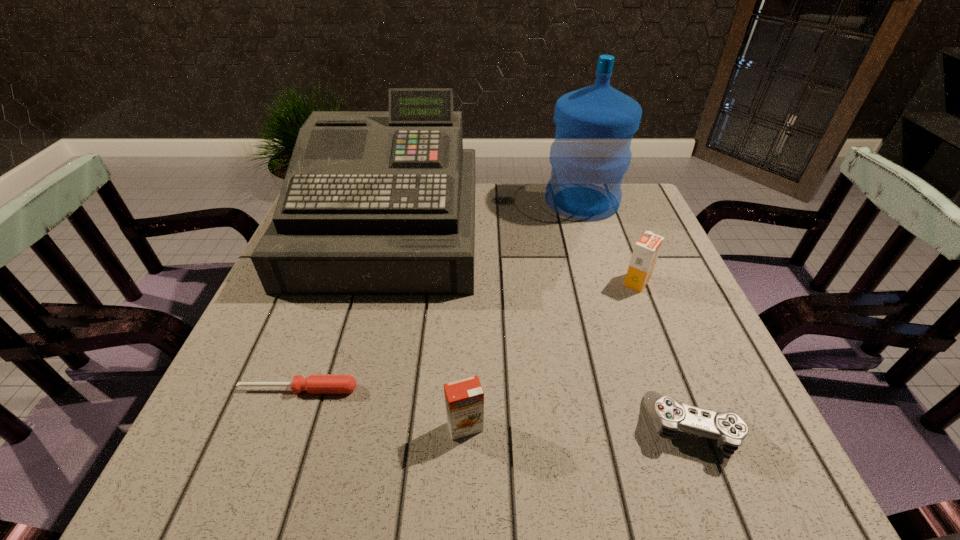
Identify the location of vacant space located 0.220m on the left of the fifth tallest object. (515, 427).

At what (x,y) coordinates should I click in order to perform the action: click on vacant space located 0.400m on the back of the shortest object. Please return your answer as a coordinate pair (x, y). This screenshot has width=960, height=540. Looking at the image, I should click on (349, 246).

You are a GUI agent. You are given a task and a screenshot of the screen. Output one action in this format:
    pyautogui.click(x=<x>, y=<y>)
    Task: Click on the water jug at the far edge
    
    Given the screenshot: What is the action you would take?
    pyautogui.click(x=591, y=152)

Find the location of a particular element. The height and width of the screenshot is (540, 960). cash register situated at the far edge is located at coordinates (373, 202).

Locate an element on the screen. Image resolution: width=960 pixels, height=540 pixels. orange juice that is at the near edge is located at coordinates (464, 399).

Image resolution: width=960 pixels, height=540 pixels. Find the location of `control that is positioned at the near edge`. control that is positioned at the near edge is located at coordinates (668, 415).

You are a GUI agent. You are given a task and a screenshot of the screen. Output one action in this format:
    pyautogui.click(x=<x>, y=<y>)
    Task: Click on the cash register that is at the left edge
    The width and height of the screenshot is (960, 540).
    Given the screenshot: What is the action you would take?
    pyautogui.click(x=373, y=202)

You are a GUI agent. You are given a task and a screenshot of the screen. Output one action in this format:
    pyautogui.click(x=<x>, y=<y>)
    Task: Click on the screwdriver that is positioned at the left edge
    Image resolution: width=960 pixels, height=540 pixels.
    Given the screenshot: What is the action you would take?
    pyautogui.click(x=315, y=384)

Identify the location of water jug located at the right edge. The width and height of the screenshot is (960, 540). (591, 152).

What are the coordinates of `orange juice located at the right edge` in the screenshot? It's located at [646, 250].